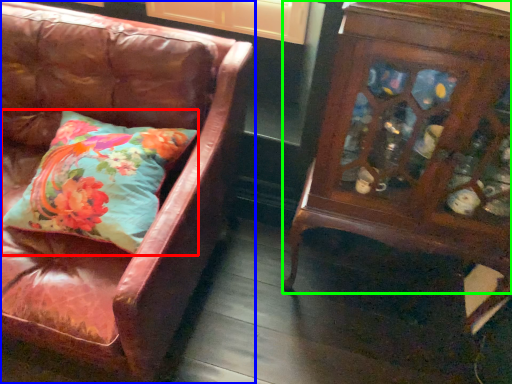
Question: Which is farther away from pillow (highlighted by a red box)? chair (highlighted by a blue box) or furniture (highlighted by a green box)?

Choices:
 (A) chair
 (B) furniture

Answer: (B)